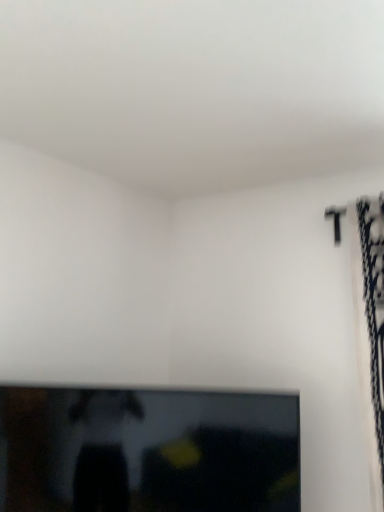
What is the approximate width of matte black tv at lower center?

It is 7.55 centimeters.

In order to face matte black tv at lower center, should I rotate leftwards or rightwards?

Turn left by 5.486 degrees to look at matte black tv at lower center.

Find the location of a particular element. The height and width of the screenshot is (512, 384). matte black tv at lower center is located at coordinates pos(148,450).

Describe the element at coordinates (148, 450) in the screenshot. The height and width of the screenshot is (512, 384). I see `matte black tv at lower center` at that location.

Find the location of a particular element. matte black tv at lower center is located at coordinates (148, 450).